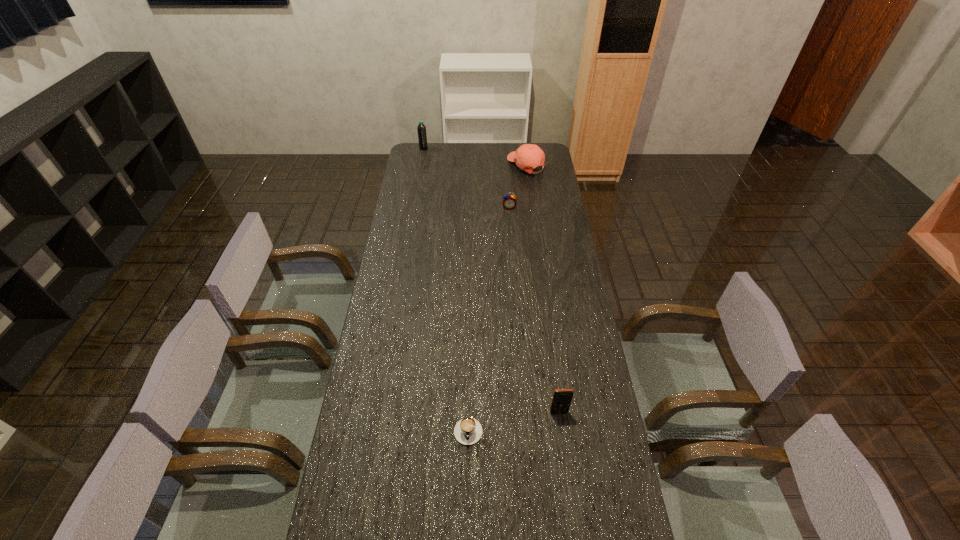
Locate an element on the screen. This screenshot has height=540, width=960. vacant space in between the farthest object and the baseball cap is located at coordinates (475, 157).

Where is `unoccupied position between the second shortest object and the cappuccino`? unoccupied position between the second shortest object and the cappuccino is located at coordinates (489, 317).

You are a GUI agent. You are given a task and a screenshot of the screen. Output one action in this format:
    pyautogui.click(x=<x>, y=<y>)
    Task: Click on the free space between the cellular telephone and the water bottle
    
    Given the screenshot: What is the action you would take?
    (x=492, y=280)

Locate an element on the screen. object that stands as the third closest to the second shortest object is located at coordinates (562, 398).

Identify which object is the nearest to the shortest object. Please provide its 2D coordinates. Your answer should be formatted as a tuple, i.e. [(x, y)], where the tuple contains the x and y coordinates of a point satisfying the conditions above.

[(562, 398)]